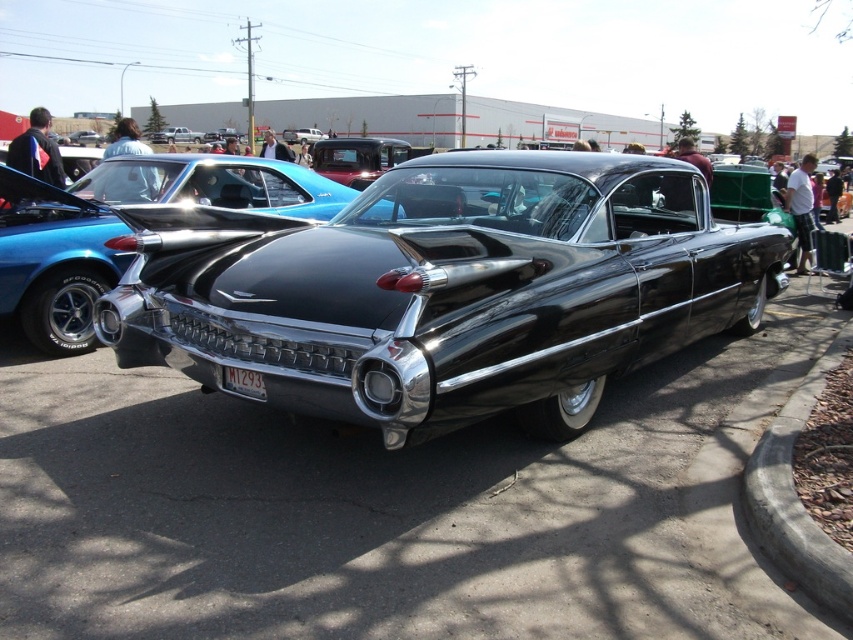
You are a photographer standing in front of the shiny black car at center and the white plastic license plate at center. You want to take a clear photo of the license plate. Which object should you focus on first to ensure the license plate is in focus?

The shiny black car at center is further to the viewer than the white plastic license plate at center. Therefore, to ensure the license plate is in focus, you should focus on the shiny black car at center first.

From the picture: You are a photographer trying to capture the shiny black car at center and the white plastic license plate at center in a single shot. Since you want to ensure both are in focus, which object should you focus on first considering their sizes and positions?

The shiny black car at center is much taller than the white plastic license plate at center, so you should focus on the shiny black car at center first as it is larger and more prominent in the frame.

You are standing in front of the classic black car at the car show. You notice two points marked on the car, one at coordinate point (167, 196) and another at point (239, 385). Which point is closer to you?

Point (167, 196) is further to the camera than point (239, 385), so the point closer to you is point (239, 385).